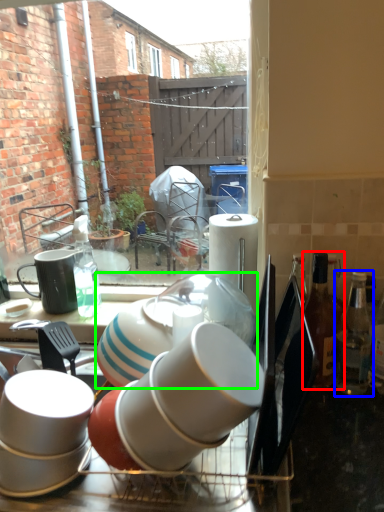
Question: Which is farther away from bottle (highlighted by a red box)? bottle (highlighted by a blue box) or tableware (highlighted by a green box)?

Choices:
 (A) bottle
 (B) tableware

Answer: (B)